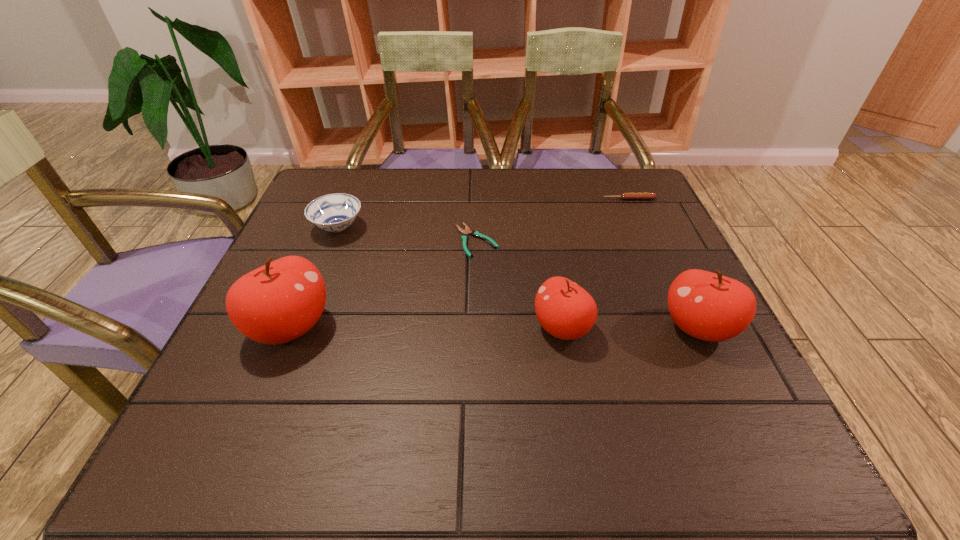
This screenshot has height=540, width=960. Find the location of `location for an additional apple to make spacing equal`. location for an additional apple to make spacing equal is located at coordinates (426, 327).